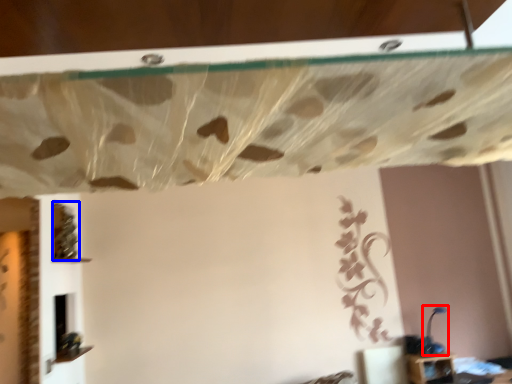
Question: Which point is further to the camera, lamp (highlighted by a red box) or vine (highlighted by a blue box)?

Choices:
 (A) lamp
 (B) vine

Answer: (A)